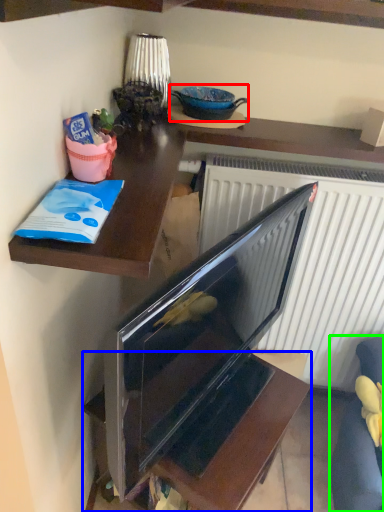
Question: Considering the real-world distances, which object is closest to appliance (highlighted by a red box)? furniture (highlighted by a blue box) or armchair (highlighted by a green box).

Choices:
 (A) furniture
 (B) armchair

Answer: (A)